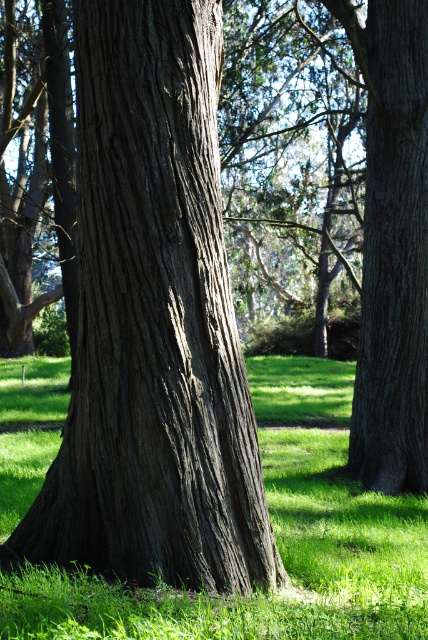
Question: Does dark brown textured bark at center have a greater width compared to dark brown textured tree trunk at center?

Choices:
 (A) no
 (B) yes

Answer: (B)

Question: Which of these objects is positioned farthest from the dark brown textured tree trunk at center?

Choices:
 (A) green grassy at center
 (B) dark brown textured bark at center

Answer: (B)

Question: Is dark brown textured bark at center positioned at the back of green grassy at center?

Choices:
 (A) yes
 (B) no

Answer: (A)

Question: From the image, what is the correct spatial relationship of dark brown textured bark at center in relation to dark brown textured tree trunk at center?

Choices:
 (A) below
 (B) above

Answer: (A)

Question: Which object appears farthest from the camera in this image?

Choices:
 (A) dark brown textured tree trunk at center
 (B) green grassy at center

Answer: (A)

Question: Which point is farther to the camera?

Choices:
 (A) (354, 384)
 (B) (329, 588)
 (C) (162, 400)

Answer: (A)